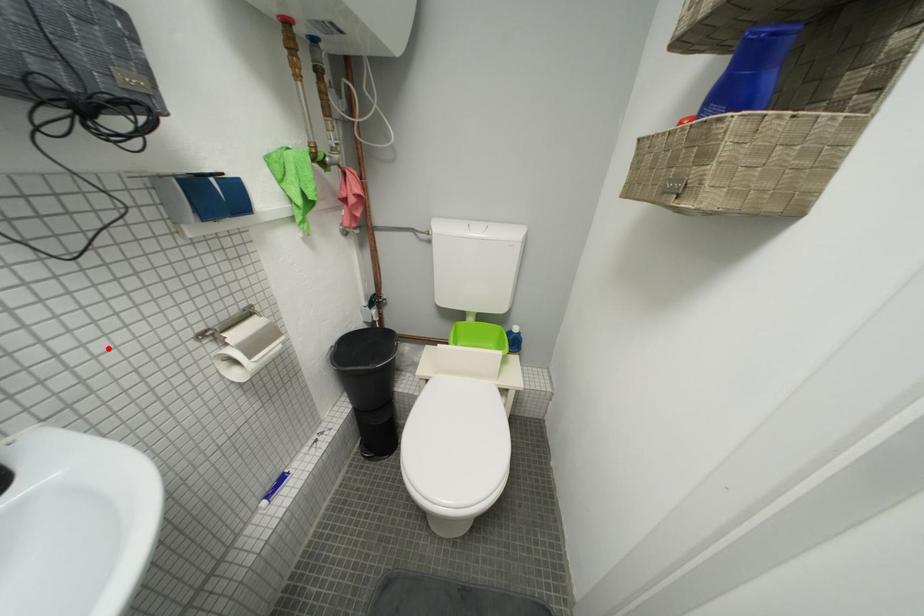
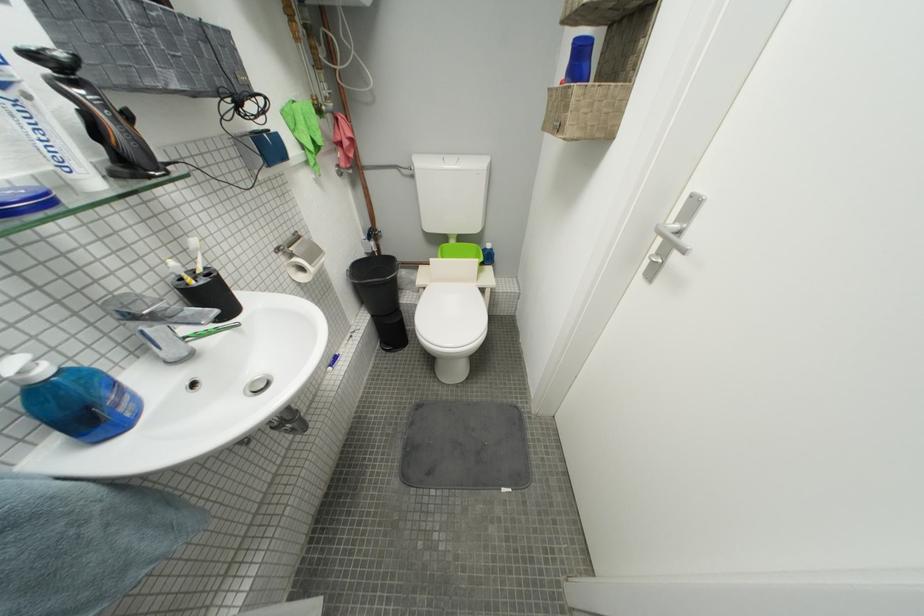
Where in the second image is the point corresponding to the highlighted location from the first image?

(247, 252)